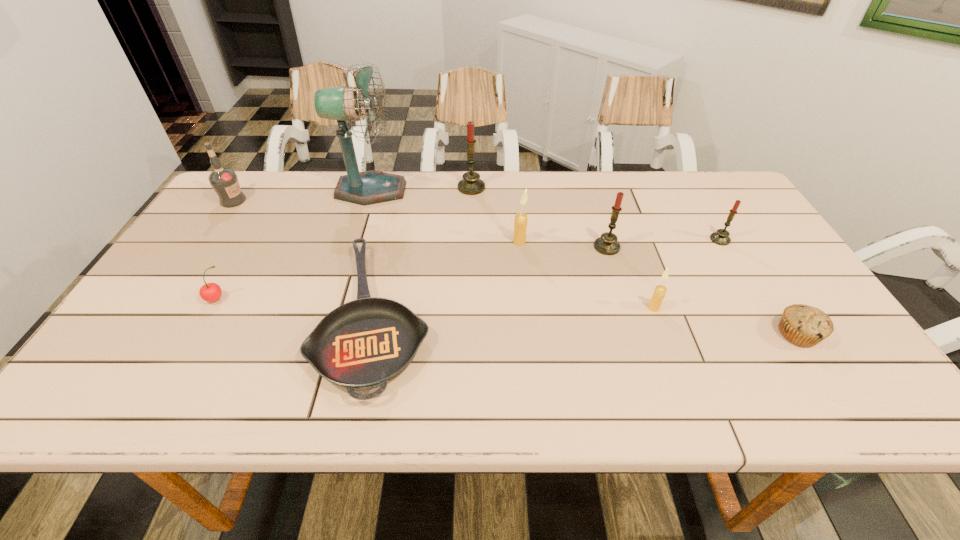
The image size is (960, 540). I want to click on blue fan, so click(x=343, y=104).

Where is `the tallest object`? The image size is (960, 540). the tallest object is located at coordinates (343, 104).

What are the coordinates of `the biggest red candle` in the screenshot? It's located at (470, 184).

The image size is (960, 540). Identify the location of the tallest candle. (470, 184).

Locate an element on the screen. This screenshot has height=540, width=960. the leftmost object is located at coordinates (224, 181).

At what (x,y) coordinates should I click in order to perform the action: click on the fourth object from right to left. Please return your answer as a coordinate pair (x, y). This screenshot has width=960, height=540. Looking at the image, I should click on (607, 244).

This screenshot has height=540, width=960. In order to click on the third candle from right to left in this screenshot , I will do `click(607, 244)`.

I want to click on the fourth candle from right to left, so click(x=520, y=224).

Find the location of a particular element. the farther cream candle is located at coordinates (520, 224).

Where is `the smallest red candle`? the smallest red candle is located at coordinates (721, 237).